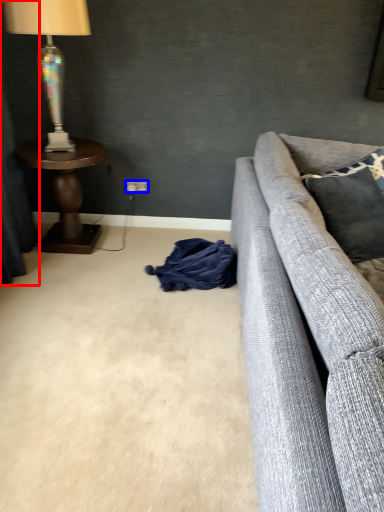
Question: Which point is further to the camera, curtain (highlighted by a red box) or power outlet (highlighted by a blue box)?

Choices:
 (A) curtain
 (B) power outlet

Answer: (B)